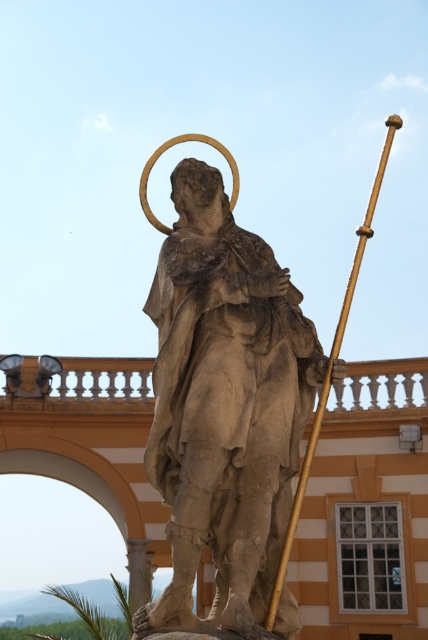
From the picture: You are standing in front of the statue of the saint and notice two points marked on the image. The first point is at coordinates point (252, 310) and the second is at point (341, 330). From your perspective, which point is closer to you?

Point (252, 310) is in front of point (341, 330), so the first point is closer to you.

You are standing at the entrance of the building in the background. You want to take a photo of the stone statue at center. Where should you position yourself to ensure the statue is centered in your camera frame?

Since the stone statue at center is located at point (225, 404), you should position yourself slightly to the right and lower your camera angle to center the statue in your frame.